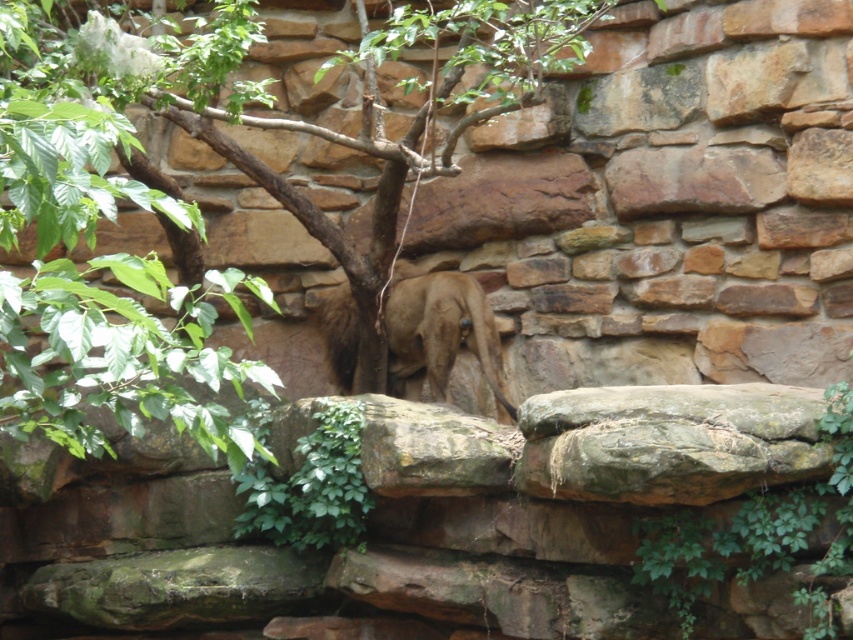
Question: Can you confirm if green leafy tree at center is bigger than brown fur at center?

Choices:
 (A) no
 (B) yes

Answer: (B)

Question: Can you confirm if green leafy tree at center is positioned above brown fur at center?

Choices:
 (A) no
 (B) yes

Answer: (B)

Question: Which object appears farthest from the camera in this image?

Choices:
 (A) green leafy tree at center
 (B) brown fur at center

Answer: (B)

Question: Which point is closer to the camera taking this photo?

Choices:
 (A) (434, 342)
 (B) (126, 170)

Answer: (A)

Question: Which point is closer to the camera?

Choices:
 (A) (221, 36)
 (B) (442, 394)

Answer: (A)

Question: Considering the relative positions of green leafy tree at center and brown fur at center in the image provided, where is green leafy tree at center located with respect to brown fur at center?

Choices:
 (A) left
 (B) right

Answer: (A)